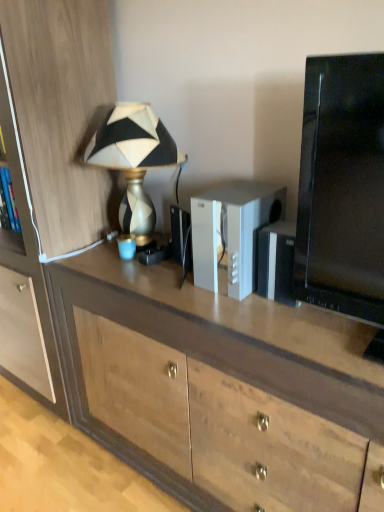
Image resolution: width=384 pixels, height=512 pixels. I want to click on wooden desk at center, so click(x=221, y=388).

The width and height of the screenshot is (384, 512). What do you see at coordinates (221, 388) in the screenshot?
I see `wooden desk at center` at bounding box center [221, 388].

What are the coordinates of `wooden cabinet at left` in the screenshot? It's located at (50, 170).

At what (x,y) coordinates should I click in order to perform the action: click on wooden desk at center. Please return your answer as a coordinate pair (x, y). This screenshot has height=512, width=384. Looking at the image, I should click on (221, 388).

Considering their positions, is metallic gold lamp at upper left located in front of or behind wooden cabinet at left?

In the image, metallic gold lamp at upper left appears behind wooden cabinet at left.

The width and height of the screenshot is (384, 512). In order to click on cabinetry in front of the metallic gold lamp at upper left in this screenshot , I will do `click(50, 170)`.

Is metallic gold lamp at upper left bigger or smaller than wooden cabinet at left?

Clearly, metallic gold lamp at upper left is smaller in size than wooden cabinet at left.

Considering the positions of objects metallic gold lamp at upper left and wooden cabinet at left in the image provided, who is more to the right, metallic gold lamp at upper left or wooden cabinet at left?

Positioned to the right is metallic gold lamp at upper left.

Can you confirm if metallic gold lamp at upper left is positioned to the left of wooden desk at center?

Yes, metallic gold lamp at upper left is to the left of wooden desk at center.

Considering the sizes of metallic gold lamp at upper left and wooden desk at center in the image, is metallic gold lamp at upper left wider or thinner than wooden desk at center?

Considering their sizes, metallic gold lamp at upper left looks slimmer than wooden desk at center.

From the image's perspective, is metallic gold lamp at upper left below wooden desk at center?

No, from the image's perspective, metallic gold lamp at upper left is not beneath wooden desk at center.

From a real-world perspective, is metallic gold lamp at upper left positioned above or below wooden desk at center?

In terms of real-world spatial position, metallic gold lamp at upper left is above wooden desk at center.

Considering the sizes of wooden cabinet at left and metallic gold lamp at upper left in the image, is wooden cabinet at left wider or thinner than metallic gold lamp at upper left?

Clearly, wooden cabinet at left has more width compared to metallic gold lamp at upper left.

Does wooden cabinet at left have a greater height compared to metallic gold lamp at upper left?

Yes, wooden cabinet at left is taller than metallic gold lamp at upper left.

Considering the sizes of objects wooden cabinet at left and metallic gold lamp at upper left in the image provided, who is smaller, wooden cabinet at left or metallic gold lamp at upper left?

Smaller between the two is metallic gold lamp at upper left.

From the image's perspective, is wooden cabinet at left above metallic gold lamp at upper left?

No, from the image's perspective, wooden cabinet at left is not over metallic gold lamp at upper left.

Is metallic gold lamp at upper left positioned with its back to white plastic speaker at center?

Answer: No.

From the picture: Between metallic gold lamp at upper left and white plastic speaker at center, which one has larger size?

metallic gold lamp at upper left is bigger.

Is metallic gold lamp at upper left touching white plastic speaker at center?

metallic gold lamp at upper left is not next to white plastic speaker at center, and they're not touching.

From the image's perspective, is wooden desk at center located above or below metallic gold lamp at upper left?

wooden desk at center is below metallic gold lamp at upper left.

Considering the relative sizes of wooden desk at center and metallic gold lamp at upper left in the image provided, is wooden desk at center bigger than metallic gold lamp at upper left?

Correct, wooden desk at center is larger in size than metallic gold lamp at upper left.

Between wooden desk at center and metallic gold lamp at upper left, which one has larger width?

With larger width is wooden desk at center.

Is point (242, 351) more distant than point (169, 158)?

No, it is not.

From the image's perspective, relative to wooden cabinet at left, is white plastic speaker at center above or below?

From the image's perspective, white plastic speaker at center appears below wooden cabinet at left.

From a real-world perspective, which object stands above the other?

white plastic speaker at center is physically above.

Is white plastic speaker at center positioned beyond the bounds of wooden desk at center?

white plastic speaker at center lies outside wooden desk at center's area.

Identify the location of appliance located above the wooden desk at center (from a real-world perspective). (232, 232).

Does white plastic speaker at center have a lesser width compared to wooden desk at center?

Indeed, white plastic speaker at center has a lesser width compared to wooden desk at center.

Which is nearer, (256, 284) or (318, 431)?

The point (318, 431) is closer.

Image resolution: width=384 pixels, height=512 pixels. What are the coordinates of `lamp that appears above the wooden cabinet at left (from the image's perspective)` in the screenshot? It's located at (134, 160).

This screenshot has width=384, height=512. I want to click on desk on the right of the metallic gold lamp at upper left, so click(221, 388).

Based on the photo, which object lies further to the anchor point wooden desk at center, white plastic speaker at center or metallic gold lamp at upper left?

metallic gold lamp at upper left.

Looking at the image, which one is located further to white plastic speaker at center, wooden desk at center or metallic gold lamp at upper left?

Based on the image, metallic gold lamp at upper left appears to be further to white plastic speaker at center.

When comparing their distances from white plastic speaker at center, does metallic gold lamp at upper left or wooden cabinet at left seem closer?

The object closer to white plastic speaker at center is metallic gold lamp at upper left.

Looking at the image, which one is located further to white plastic speaker at center, wooden cabinet at left or metallic gold lamp at upper left?

wooden cabinet at left.

Estimate the real-world distances between objects in this image. Which object is closer to white plastic speaker at center, metallic gold lamp at upper left or wooden desk at center?

wooden desk at center.

When comparing their distances from metallic gold lamp at upper left, does white plastic speaker at center or wooden desk at center seem further?

wooden desk at center.

From the image, which object appears to be farther from wooden desk at center, metallic gold lamp at upper left or white plastic speaker at center?

Based on the image, metallic gold lamp at upper left appears to be further to wooden desk at center.

Based on their spatial positions, is wooden cabinet at left or white plastic speaker at center further from metallic gold lamp at upper left?

Based on the image, white plastic speaker at center appears to be further to metallic gold lamp at upper left.

Where is `appliance between metallic gold lamp at upper left and wooden desk at center from top to bottom`? The width and height of the screenshot is (384, 512). appliance between metallic gold lamp at upper left and wooden desk at center from top to bottom is located at coordinates (232, 232).

The height and width of the screenshot is (512, 384). Identify the location of desk between wooden cabinet at left and white plastic speaker at center. tap(221, 388).

I want to click on lamp between wooden cabinet at left and wooden desk at center, so click(134, 160).

You are a GUI agent. You are given a task and a screenshot of the screen. Output one action in this format:
    pyautogui.click(x=<x>, y=<y>)
    Task: Click on the lamp between wooden cabinet at left and white plastic speaker at center
    Image resolution: width=384 pixels, height=512 pixels.
    Given the screenshot: What is the action you would take?
    pyautogui.click(x=134, y=160)